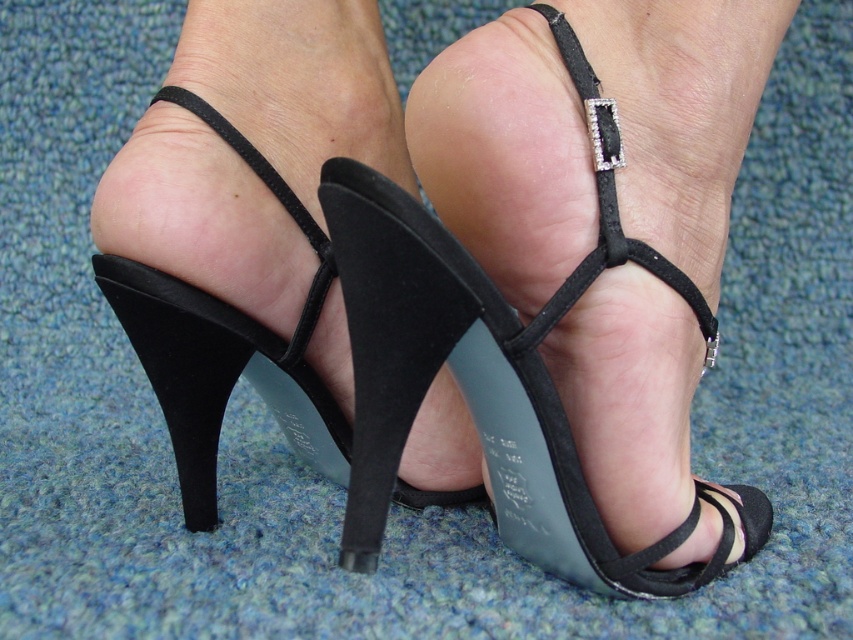
You are a photographer setting up a shoot for a fashion magazine. You want to highlight the intricate details of both the black suede strap at center and the black suede heel at lower center. Since the background is blue carpeted floor, which object should you focus on to ensure the details are clearly visible against the background?

The black suede strap at center should be focused on because it is positioned over the black suede heel at lower center, making it closer to the camera and thus more detailed against the blue background.